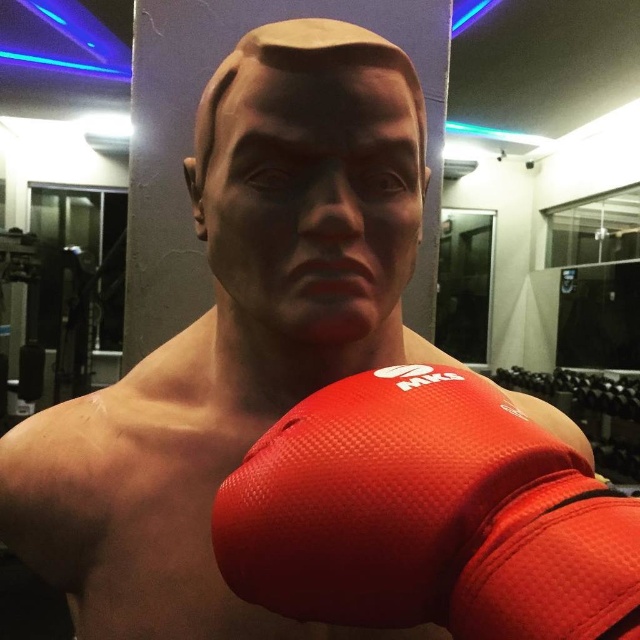
Between red mesh boxing glove at center and matte black face at center, which one appears on the left side from the viewer's perspective?

Positioned to the left is matte black face at center.

Who is more distant from viewer, (228, 531) or (250, 80)?

The point (250, 80) is more distant.

Is point (298, 474) farther from viewer compared to point (211, 173)?

No, it is in front of (211, 173).

Find the location of a particular element. red mesh boxing glove at center is located at coordinates (428, 516).